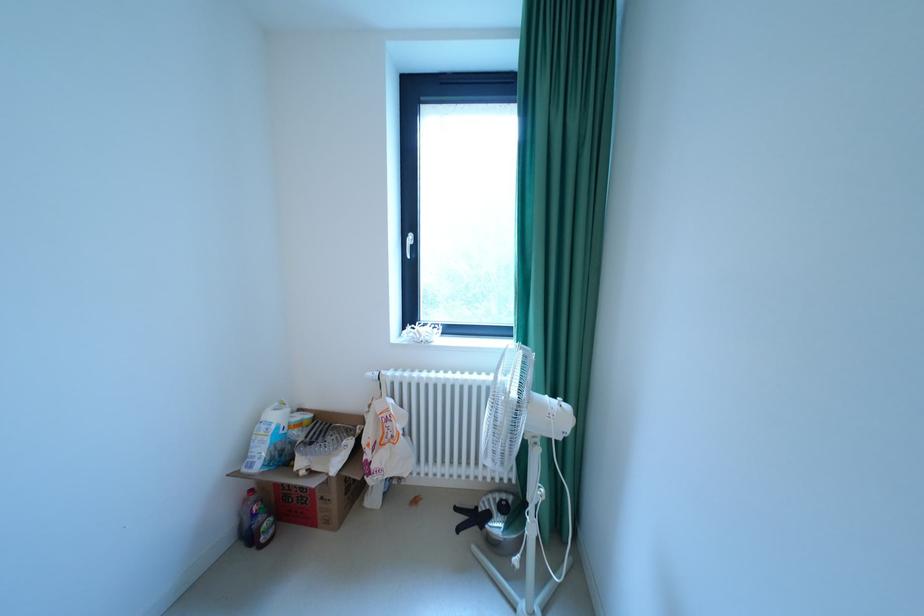
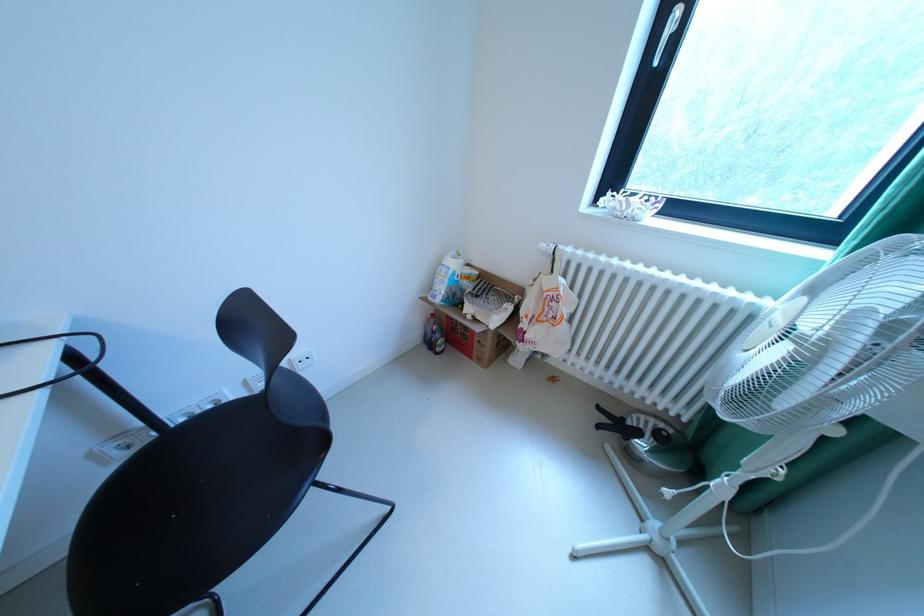
In the second image, find the point that corresponds to point (399, 437) in the first image.

(561, 317)